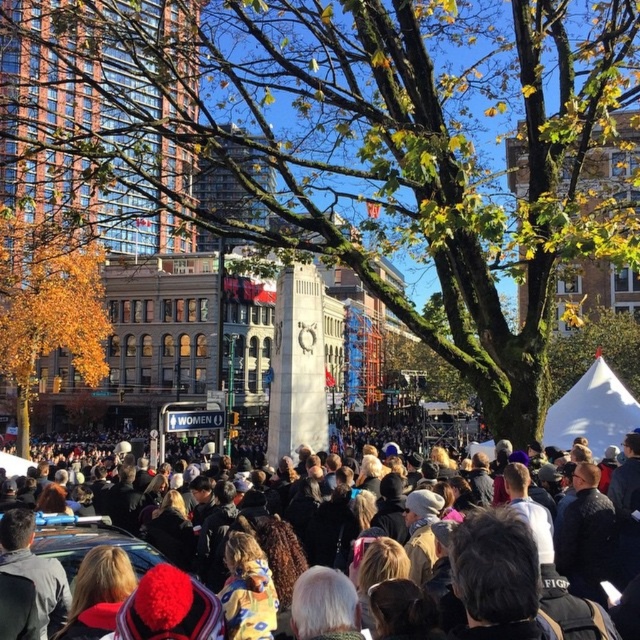
In the urban scene with the crowd and the monument, there is a point labeled as point (348,141). What object is this point located on?

The point (348,141) is located on the green mossy tree at center.

You are a photographer trying to capture a clear photo of the green mossy tree at center and the dark brown fur coat at center. Which object should you focus on first to ensure it appears larger in your photo?

The green mossy tree at center is taller than the dark brown fur coat at center, so you should focus on the green mossy tree at center first to ensure it appears larger in your photo.